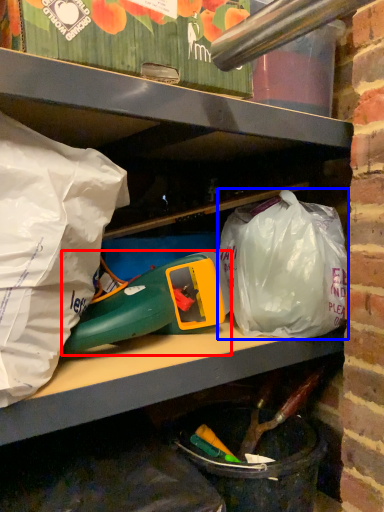
Question: Which point is further to the camera, toy (highlighted by a red box) or plastic bag (highlighted by a blue box)?

Choices:
 (A) toy
 (B) plastic bag

Answer: (B)